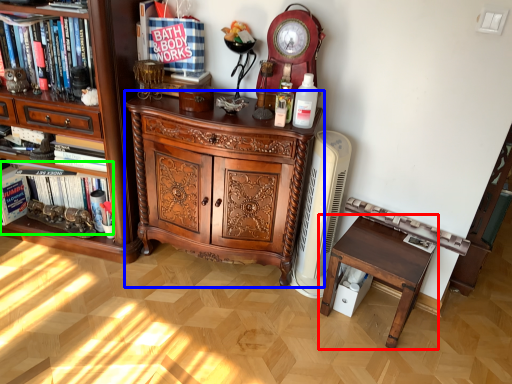
Question: Considering the real-world distances, which object is closest to table (highlighted by a red box)? chest of drawers (highlighted by a blue box) or book (highlighted by a green box).

Choices:
 (A) chest of drawers
 (B) book

Answer: (A)